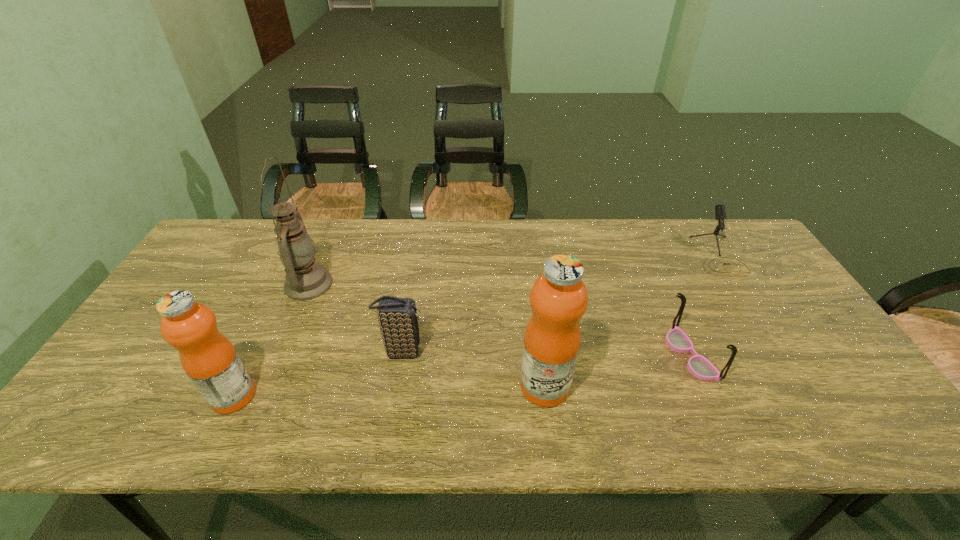
Locate an element on the screen. Image resolution: width=960 pixels, height=540 pixels. vacant region located 0.170m on the right of the right fruit juice is located at coordinates (641, 386).

What are the coordinates of `free location located on the stand of the rightmost object` in the screenshot? It's located at (785, 362).

In order to click on free point located 0.240m on the back of the oil lamp in this screenshot , I will do `click(335, 221)`.

Identify the location of vacant region located with the zip open on the third object from left to right. The height and width of the screenshot is (540, 960). (562, 352).

The width and height of the screenshot is (960, 540). Identify the location of vacant point located 0.390m on the left of the spectacles. (514, 355).

The width and height of the screenshot is (960, 540). In order to click on object that is at the far edge in this screenshot , I will do `click(720, 213)`.

Where is `spectacles that is at the near edge`? The width and height of the screenshot is (960, 540). spectacles that is at the near edge is located at coordinates (700, 367).

In order to click on object at the right edge in this screenshot , I will do `click(720, 213)`.

Identify the location of object at the far right corner. (720, 213).

At what (x,y) coordinates should I click in order to perform the action: click on vacant space at the far edge of the desktop. Please return your answer as a coordinate pair (x, y). The height and width of the screenshot is (540, 960). Looking at the image, I should click on (533, 230).